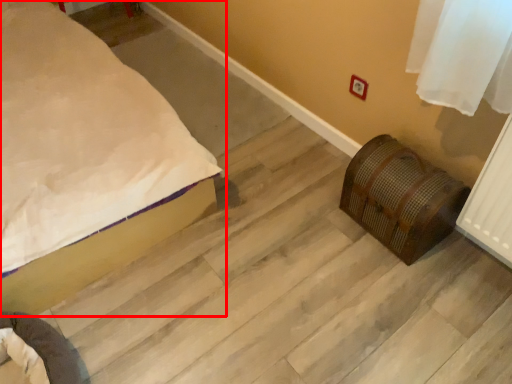
Question: In this image, where is bed (annotated by the red box) located relative to furniture?

Choices:
 (A) left
 (B) right

Answer: (A)